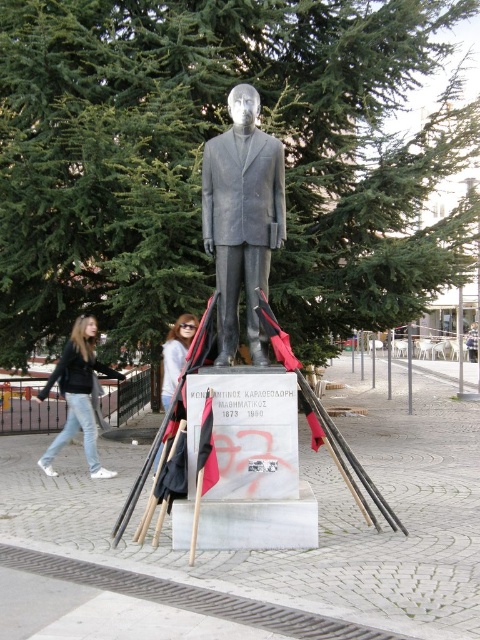
You are standing at point (x=241, y=218) in the public square. What object is located exactly at your current position?

The bronze statue at center is located exactly at point (x=241, y=218).

You are standing at the statue of Konstantinos Karafotopoulos in the public square. There are two points marked on the ground near the statue. The first point is at coordinates point (208,211) and the second is at point (98,476). If you face the statue, which point is closer to you?

Point (208,211) is in front of point (98,476), so if you are facing the statue, point (208,211) is closer to you.

You are a tourist visiting the square and want to take a photo of the bronze statue at center without any people in the frame. You notice that a person wearing jeans at lower left is blocking your view. Based on their positions, can you move to the left or right to avoid the person?

The bronze statue at center is positioned on the right side of jeans at lower left. To avoid the person wearing jeans at lower left, you should move to the right side of the bronze statue at center so that the statue is between you and the person.